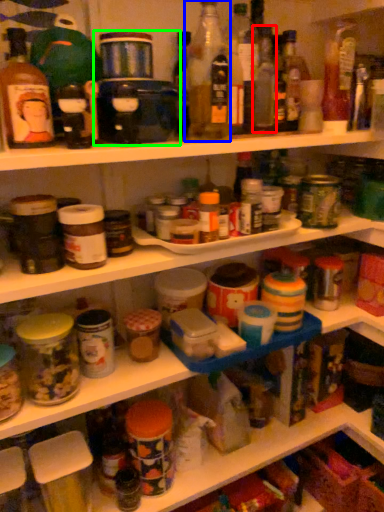
Question: Which object is the closest to the bottle (highlighted by a red box)? Choose among these: bottle (highlighted by a blue box) or appliance (highlighted by a green box).

Choices:
 (A) bottle
 (B) appliance

Answer: (A)